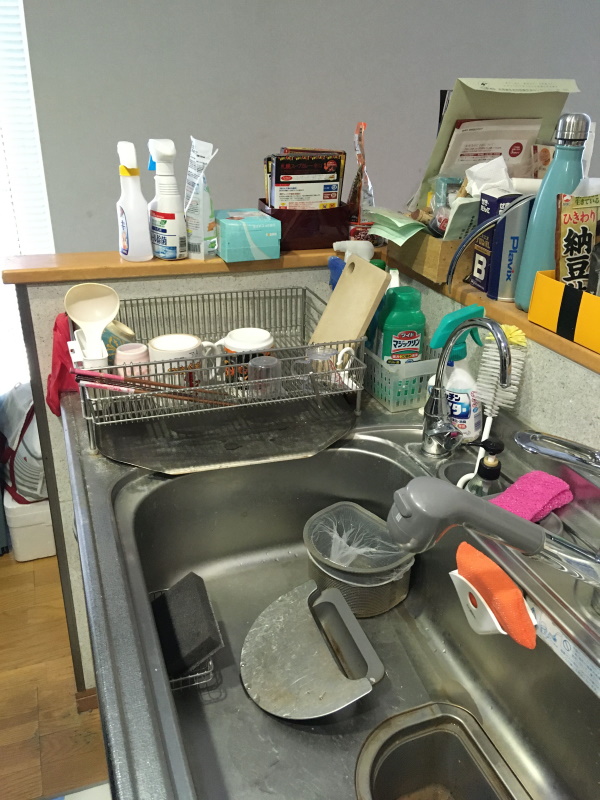
Identify the location of sponge. The height and width of the screenshot is (800, 600). (196, 585).